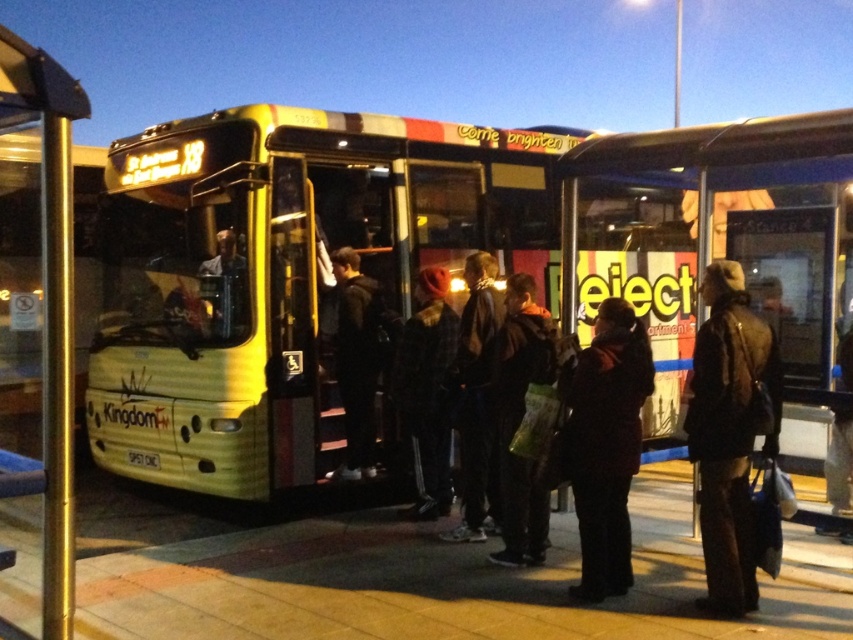
You are a bus driver who needs to park your yellow metallic bus at center at the bus stop. There is a metallic gold pole at left nearby. Considering the size of the pole, will the bus fit in the parking space without hitting the pole?

The yellow metallic bus at center is bigger than the metallic gold pole at left. Since the bus is larger, it should have enough space to park without hitting the pole, provided the parking space is appropriately sized for the bus.

Based on the scene description, where is the metallic gold pole at left located in terms of coordinates?

The metallic gold pole at left is located at coordinates point (49, 307).